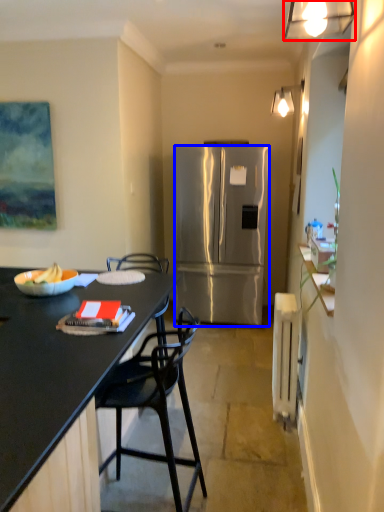
Question: Among these objects, which one is nearest to the camera, lamp (highlighted by a red box) or refrigerator (highlighted by a blue box)?

Choices:
 (A) lamp
 (B) refrigerator

Answer: (A)